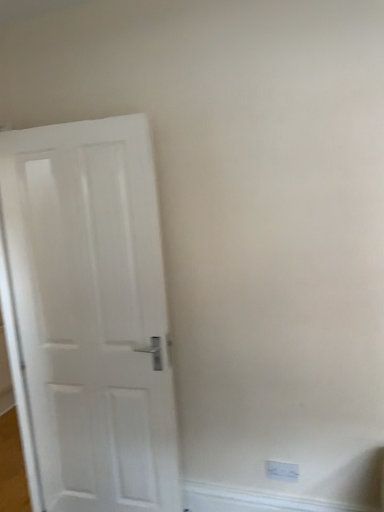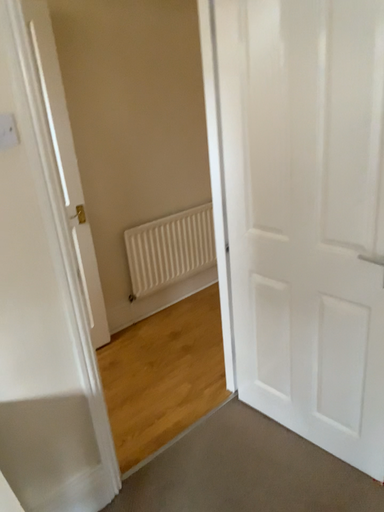
Question: Which way did the camera rotate in the video?

Choices:
 (A) rotated downward
 (B) rotated upward

Answer: (A)